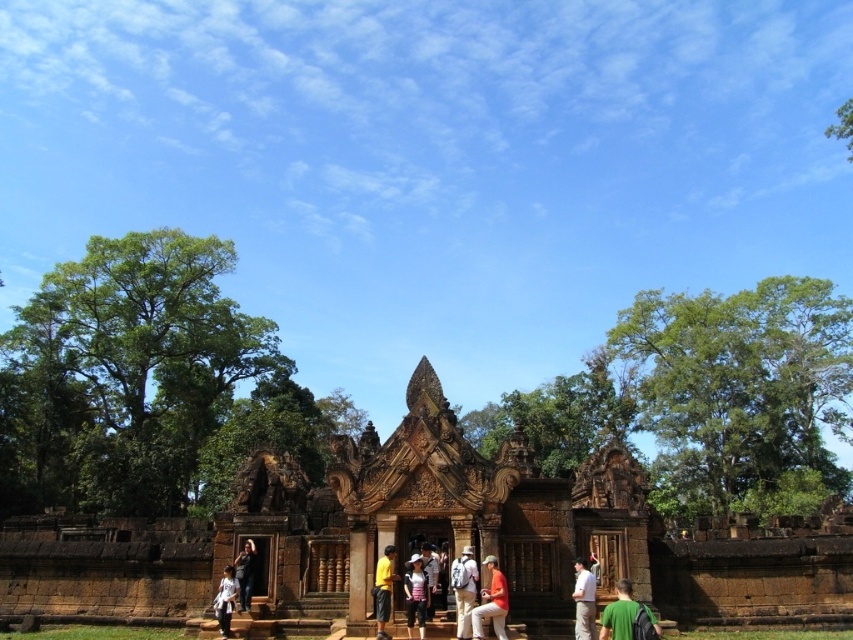
Is matte black shirt at center behind white cotton shirt at center?

No, matte black shirt at center is in front of white cotton shirt at center.

Describe the element at coordinates (415, 595) in the screenshot. The width and height of the screenshot is (853, 640). I see `matte black shirt at center` at that location.

Locate an element on the screen. matte black shirt at center is located at coordinates (415, 595).

Between point (465, 614) and point (434, 557), which one is positioned in front?

Point (465, 614) is in front.

Find the location of a particular element. white fabric backpack at center is located at coordinates (463, 589).

The width and height of the screenshot is (853, 640). I want to click on white fabric backpack at center, so pyautogui.click(x=463, y=589).

Does green fabric backpack at lower right have a smaller size compared to matte black shirt at center?

No.

Does point (625, 586) come closer to viewer compared to point (419, 554)?

Yes.

Measure the distance between green fabric backpack at lower right and camera.

A distance of 43.20 meters exists between green fabric backpack at lower right and camera.

Find the location of a particular element. Image resolution: width=853 pixels, height=640 pixels. green fabric backpack at lower right is located at coordinates (619, 612).